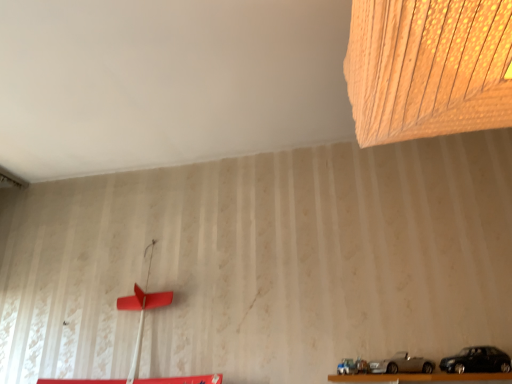
The width and height of the screenshot is (512, 384). In order to click on black matte car at lower right, which appears as the 1th car when viewed from the right in this screenshot , I will do `click(477, 361)`.

The width and height of the screenshot is (512, 384). What do you see at coordinates (402, 364) in the screenshot?
I see `silver metallic car at lower center, the 2th car positioned from the right` at bounding box center [402, 364].

What do you see at coordinates (428, 67) in the screenshot? I see `wooden textured lampshade at upper right` at bounding box center [428, 67].

Image resolution: width=512 pixels, height=384 pixels. In order to click on black matte car at lower right, which appears as the 1th car when viewed from the right in this screenshot , I will do `click(477, 361)`.

Is wooden textured lampshade at upper right a part of silver metallic car at lower center, the 2th car positioned from the right?

No, wooden textured lampshade at upper right is not a part of silver metallic car at lower center, the 2th car positioned from the right.

At what (x,y) coordinates should I click in order to perform the action: click on lamp located above the silver metallic car at lower center, the 2th car positioned from the right (from the image's perspective). Please return your answer as a coordinate pair (x, y). Looking at the image, I should click on (428, 67).

From a real-world perspective, is silver metallic car at lower center, which is the first car in left-to-right order, positioned over wooden textured lampshade at upper right based on gravity?

No.

Is silver metallic car at lower center, which is the first car in left-to-right order, not near wooden textured lampshade at upper right?

Yes.

From the picture: Is black matte car at lower right, which appears as the 1th car when viewed from the right, placed right next to wooden textured lampshade at upper right?

They are not placed beside each other.

Would you say black matte car at lower right, the second car when ordered from left to right, is to the left or to the right of wooden textured lampshade at upper right in the picture?

From the image, it's evident that black matte car at lower right, the second car when ordered from left to right, is to the right of wooden textured lampshade at upper right.

This screenshot has height=384, width=512. I want to click on lamp located in front of the black matte car at lower right, which appears as the 1th car when viewed from the right, so click(x=428, y=67).

Considering the relative sizes of black matte car at lower right, the second car when ordered from left to right, and wooden textured lampshade at upper right in the image provided, is black matte car at lower right, the second car when ordered from left to right, shorter than wooden textured lampshade at upper right?

Correct, black matte car at lower right, the second car when ordered from left to right, is not as tall as wooden textured lampshade at upper right.

Based on the photo, considering their positions, is silver metallic car at lower center, which is the first car in left-to-right order, located in front of or behind black matte car at lower right, the second car when ordered from left to right?

In the image, silver metallic car at lower center, which is the first car in left-to-right order, appears behind black matte car at lower right, the second car when ordered from left to right.

Is silver metallic car at lower center, the 2th car positioned from the right, facing towards black matte car at lower right, which appears as the 1th car when viewed from the right?

No, silver metallic car at lower center, the 2th car positioned from the right, is not aimed at black matte car at lower right, which appears as the 1th car when viewed from the right.

Looking at their sizes, would you say silver metallic car at lower center, the 2th car positioned from the right, is wider or thinner than black matte car at lower right, the second car when ordered from left to right?

Considering their sizes, silver metallic car at lower center, the 2th car positioned from the right, looks broader than black matte car at lower right, the second car when ordered from left to right.

Which object is positioned more to the left, silver metallic car at lower center, the 2th car positioned from the right, or black matte car at lower right, the second car when ordered from left to right?

From the viewer's perspective, silver metallic car at lower center, the 2th car positioned from the right, appears more on the left side.

From a real-world perspective, is black matte car at lower right, the second car when ordered from left to right, located higher than silver metallic car at lower center, the 2th car positioned from the right?

Yes, from a real-world perspective, black matte car at lower right, the second car when ordered from left to right, is above silver metallic car at lower center, the 2th car positioned from the right.

Does point (488, 362) lie behind point (433, 370)?

No, (488, 362) is in front of (433, 370).

Where is `car behind the black matte car at lower right, which appears as the 1th car when viewed from the right`? The height and width of the screenshot is (384, 512). car behind the black matte car at lower right, which appears as the 1th car when viewed from the right is located at coordinates (402, 364).

Is wooden textured lampshade at upper right positioned far away from silver metallic car at lower center, the 2th car positioned from the right?

Yes, wooden textured lampshade at upper right and silver metallic car at lower center, the 2th car positioned from the right, are quite far apart.

From the image's perspective, is wooden textured lampshade at upper right on silver metallic car at lower center, which is the first car in left-to-right order?

Yes, from the image's perspective, wooden textured lampshade at upper right is over silver metallic car at lower center, which is the first car in left-to-right order.

Would you say wooden textured lampshade at upper right is outside silver metallic car at lower center, the 2th car positioned from the right?

Absolutely, wooden textured lampshade at upper right is external to silver metallic car at lower center, the 2th car positioned from the right.

From a real-world perspective, starting from the wooden textured lampshade at upper right, which car is the 2nd one below it? Please provide its 2D coordinates.

[(402, 364)]

Can you see wooden textured lampshade at upper right touching black matte car at lower right, which appears as the 1th car when viewed from the right?

They are not placed beside each other.

Considering the relative sizes of wooden textured lampshade at upper right and black matte car at lower right, which appears as the 1th car when viewed from the right, in the image provided, is wooden textured lampshade at upper right bigger than black matte car at lower right, which appears as the 1th car when viewed from the right,?

Yes, wooden textured lampshade at upper right is bigger than black matte car at lower right, which appears as the 1th car when viewed from the right.

Between point (418, 4) and point (454, 359), which one is positioned in front?

The point (418, 4) is more forward.

What are the coordinates of `lamp above the silver metallic car at lower center, the 2th car positioned from the right (from the image's perspective)` in the screenshot? It's located at (428, 67).

At what (x,y) coordinates should I click in order to perform the action: click on the 2nd car to the right of the wooden textured lampshade at upper right, starting your count from the anchor. Please return your answer as a coordinate pair (x, y). Looking at the image, I should click on (477, 361).

Considering their positions, is silver metallic car at lower center, the 2th car positioned from the right, positioned closer to black matte car at lower right, the second car when ordered from left to right, than wooden textured lampshade at upper right?

Among the two, silver metallic car at lower center, the 2th car positioned from the right, is located nearer to black matte car at lower right, the second car when ordered from left to right.

Estimate the real-world distances between objects in this image. Which object is closer to wooden textured lampshade at upper right, black matte car at lower right, which appears as the 1th car when viewed from the right, or silver metallic car at lower center, the 2th car positioned from the right?

black matte car at lower right, which appears as the 1th car when viewed from the right.

From the image, which object appears to be farther from silver metallic car at lower center, the 2th car positioned from the right, wooden textured lampshade at upper right or black matte car at lower right, the second car when ordered from left to right?

Among the two, wooden textured lampshade at upper right is located further to silver metallic car at lower center, the 2th car positioned from the right.

When comparing their distances from silver metallic car at lower center, which is the first car in left-to-right order, does black matte car at lower right, which appears as the 1th car when viewed from the right, or wooden textured lampshade at upper right seem closer?

Based on the image, black matte car at lower right, which appears as the 1th car when viewed from the right, appears to be nearer to silver metallic car at lower center, which is the first car in left-to-right order.

Which object lies further to the anchor point wooden textured lampshade at upper right, silver metallic car at lower center, the 2th car positioned from the right, or black matte car at lower right, the second car when ordered from left to right?

Based on the image, silver metallic car at lower center, the 2th car positioned from the right, appears to be further to wooden textured lampshade at upper right.

Estimate the real-world distances between objects in this image. Which object is further from black matte car at lower right, the second car when ordered from left to right, wooden textured lampshade at upper right or silver metallic car at lower center, the 2th car positioned from the right?

wooden textured lampshade at upper right.

Where is `car between wooden textured lampshade at upper right and silver metallic car at lower center, the 2th car positioned from the right, from top to bottom`? car between wooden textured lampshade at upper right and silver metallic car at lower center, the 2th car positioned from the right, from top to bottom is located at coordinates click(x=477, y=361).